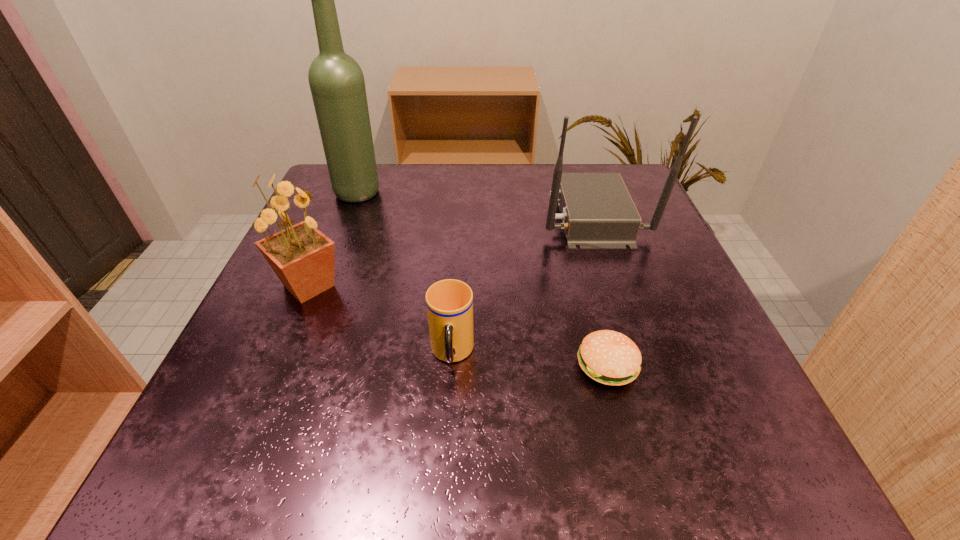
At what (x,y) coordinates should I click in order to perform the action: click on blank region between the fourth tallest object and the third farthest object. Please return your answer as a coordinate pair (x, y). The height and width of the screenshot is (540, 960). Looking at the image, I should click on (380, 320).

Where is `vacant space that is in between the router and the shortest object`? vacant space that is in between the router and the shortest object is located at coordinates (600, 291).

The height and width of the screenshot is (540, 960). Identify the location of blank region between the shortest object and the router. (600, 291).

Identify the location of free space between the third nearest object and the tallest object. The height and width of the screenshot is (540, 960). (334, 239).

The height and width of the screenshot is (540, 960). What are the coordinates of `free area in between the third nearest object and the router` in the screenshot? It's located at (450, 251).

The image size is (960, 540). Identify the location of blank region between the patty and the tallest object. (483, 279).

Select which object is the third closest to the patty. Please provide its 2D coordinates. Your answer should be formatted as a tuple, i.e. [(x, y)], where the tuple contains the x and y coordinates of a point satisfying the conditions above.

[(302, 257)]

Identify which object is the fourth nearest to the wine bottle. Please provide its 2D coordinates. Your answer should be formatted as a tuple, i.e. [(x, y)], where the tuple contains the x and y coordinates of a point satisfying the conditions above.

[(611, 358)]

Where is `free space that satisfies the following two spatial constraints: 1. at the front of the sunflower with flowers visible; 2. on the left side of the patty`? free space that satisfies the following two spatial constraints: 1. at the front of the sunflower with flowers visible; 2. on the left side of the patty is located at coordinates (276, 365).

This screenshot has width=960, height=540. In order to click on vacant space that satisfies the following two spatial constraints: 1. at the front of the shortest object with flowers visible; 2. on the left side of the third nearest object in this screenshot , I will do 276,365.